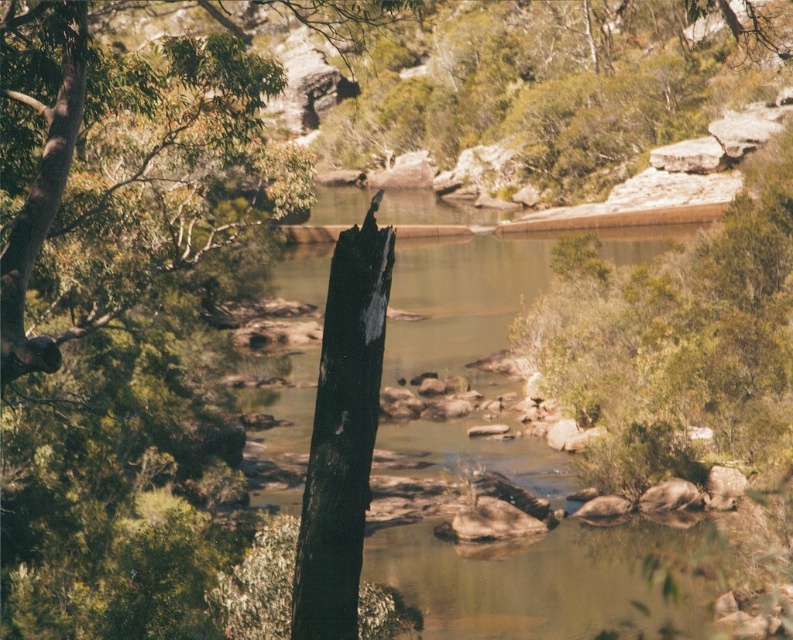
Is clear water at center to the right of green leafy tree at left from the viewer's perspective?

Correct, you'll find clear water at center to the right of green leafy tree at left.

Is clear water at center below green leafy tree at left?

Yes, clear water at center is below green leafy tree at left.

The height and width of the screenshot is (640, 793). What are the coordinates of `clear water at center` in the screenshot? It's located at (519, 580).

This screenshot has height=640, width=793. I want to click on clear water at center, so click(x=519, y=580).